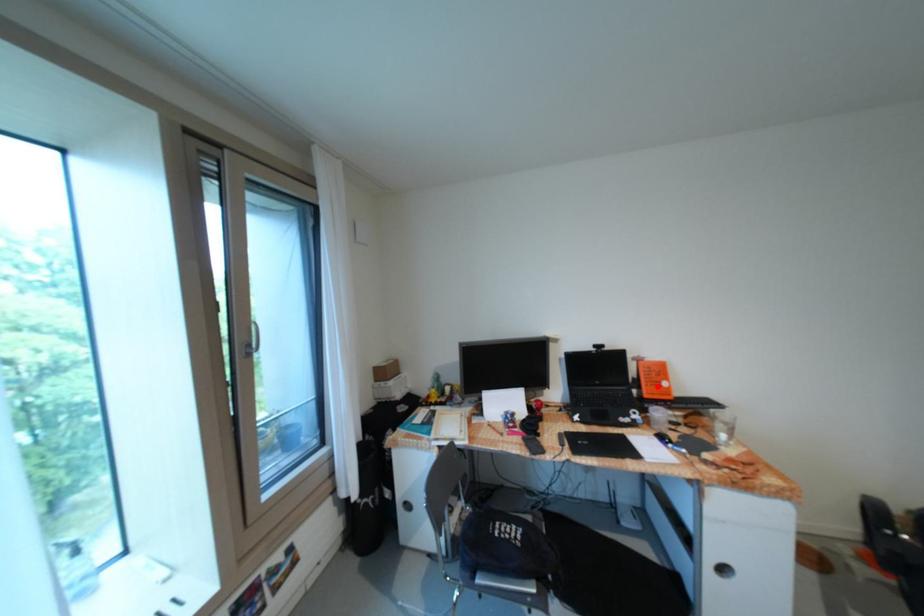
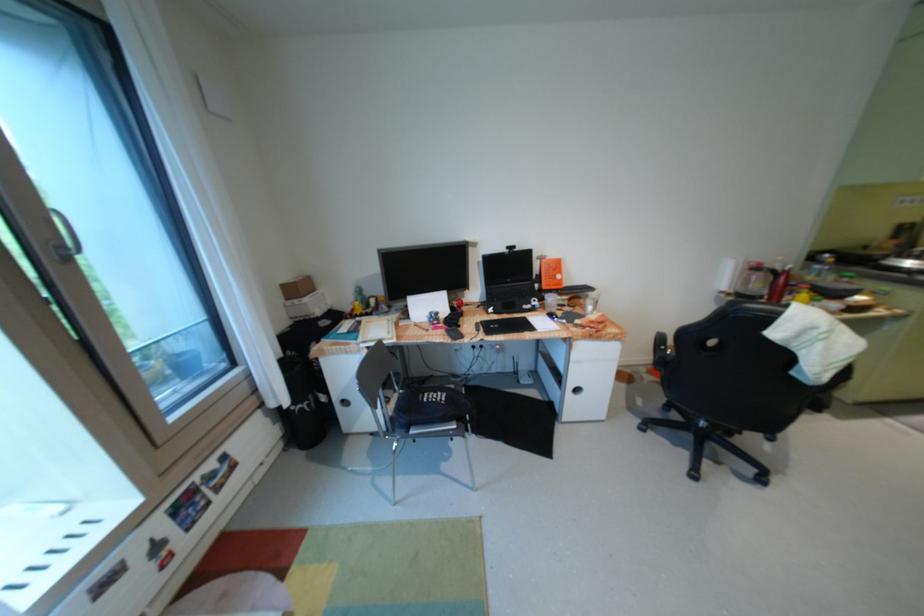
Find the pixel in the second image that matches the highlighted location in the first image.

(555, 280)